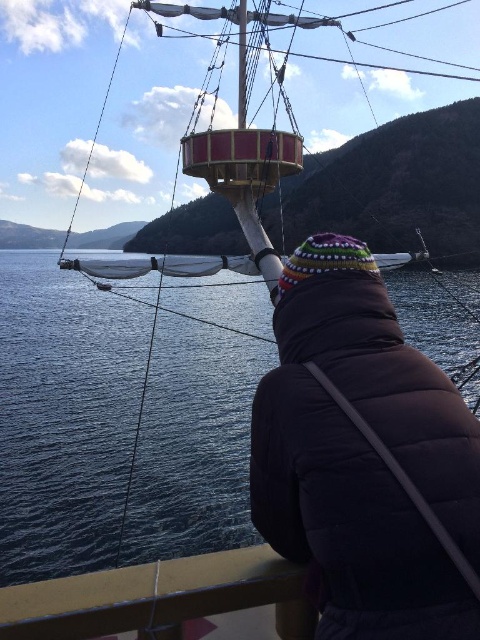
Does blue water at center have a lesser width compared to multicolored knit hat at center?

No, blue water at center is not thinner than multicolored knit hat at center.

At what (x,y) coordinates should I click in order to perform the action: click on blue water at center. Please return your answer as a coordinate pair (x, y). Image resolution: width=480 pixels, height=640 pixels. Looking at the image, I should click on (63, 416).

Is point (2, 376) farther from camera compared to point (352, 528)?

Yes.

Identify the location of blue water at center. (63, 416).

Can you confirm if blue water at center is wider than brown wooden deck at lower center?

Correct, the width of blue water at center exceeds that of brown wooden deck at lower center.

Between blue water at center and brown wooden deck at lower center, which one has less height?

Standing shorter between the two is brown wooden deck at lower center.

Where is `blue water at center`? blue water at center is located at coordinates (63, 416).

Does multicolored knit hat at center have a greater width compared to brown wooden deck at lower center?

No.

Which is behind, point (277, 308) or point (238, 616)?

Point (277, 308)

Find the location of a particular element. The height and width of the screenshot is (640, 480). multicolored knit hat at center is located at coordinates (364, 458).